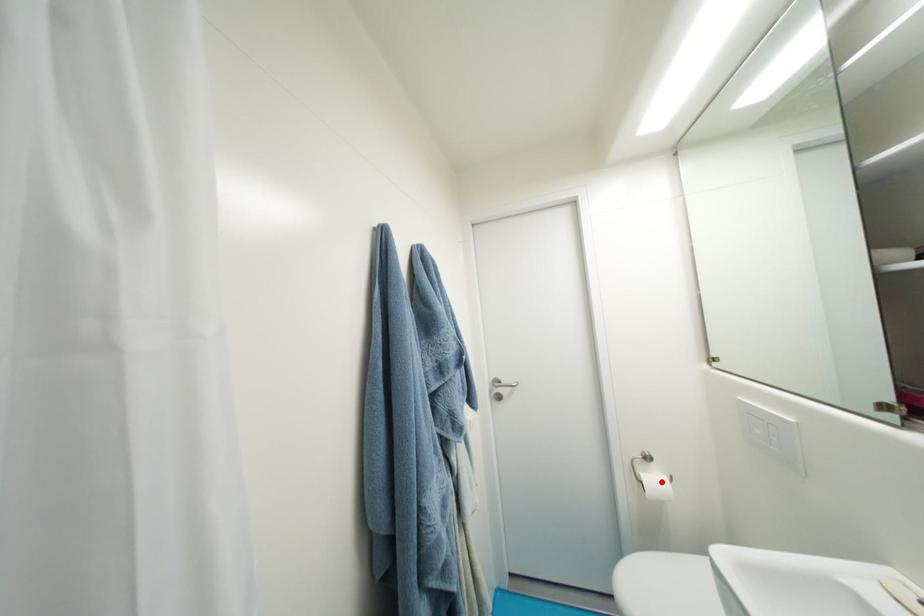
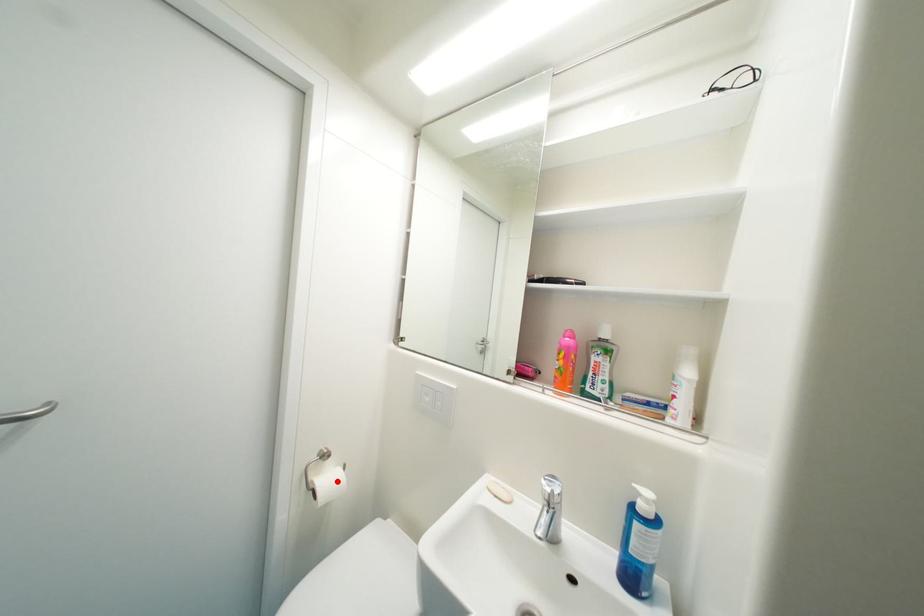
I am providing you with two images of the same scene from different viewpoints. A red point is marked on the first image and another point is marked on the second image. Does the point marked in image1 correspond to the same location as the one in image2?

Yes